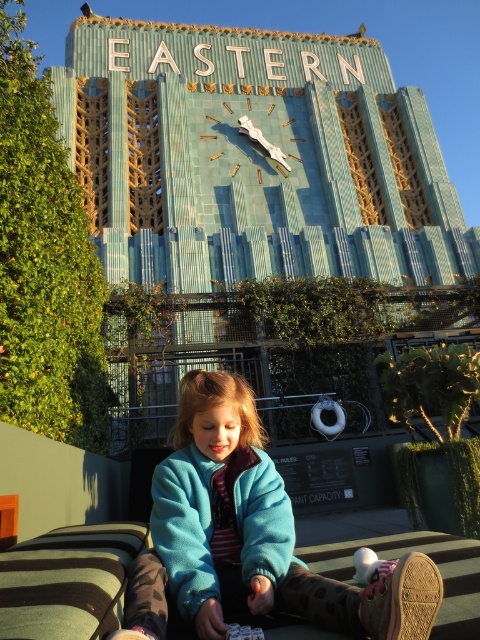
Can you confirm if blue fleece jacket at center is bigger than silver metallic clock at upper center?

Yes.

Measure the distance between point (148, 589) and camera.

The distance of point (148, 589) from camera is 15.25 meters.

Find the location of a particular element. blue fleece jacket at center is located at coordinates (250, 538).